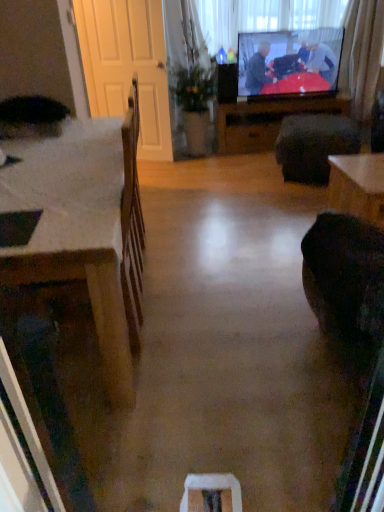
Question: Should I look upward or downward to see green leafy plant at center?

Choices:
 (A) up
 (B) down

Answer: (A)

Question: Is green leafy plant at center bigger than wooden desk at left?

Choices:
 (A) no
 (B) yes

Answer: (A)

Question: Is green leafy plant at center aimed at wooden desk at left?

Choices:
 (A) no
 (B) yes

Answer: (B)

Question: Is green leafy plant at center positioned before wooden desk at left?

Choices:
 (A) no
 (B) yes

Answer: (A)

Question: Is wooden desk at left at the back of green leafy plant at center?

Choices:
 (A) no
 (B) yes

Answer: (A)

Question: Can you confirm if green leafy plant at center is shorter than wooden desk at left?

Choices:
 (A) yes
 (B) no

Answer: (B)

Question: Does green leafy plant at center have a greater height compared to wooden desk at left?

Choices:
 (A) yes
 (B) no

Answer: (A)

Question: Is wooden desk at left to the right of transparent plastic window screen at upper center from the viewer's perspective?

Choices:
 (A) no
 (B) yes

Answer: (A)

Question: Is wooden desk at left aimed at transparent plastic window screen at upper center?

Choices:
 (A) no
 (B) yes

Answer: (A)

Question: Is wooden desk at left not within transparent plastic window screen at upper center?

Choices:
 (A) no
 (B) yes

Answer: (B)

Question: From a real-world perspective, is wooden desk at left physically below transparent plastic window screen at upper center?

Choices:
 (A) no
 (B) yes

Answer: (B)

Question: Does wooden desk at left have a greater width compared to transparent plastic window screen at upper center?

Choices:
 (A) no
 (B) yes

Answer: (B)

Question: Can you confirm if wooden desk at left is thinner than transparent plastic window screen at upper center?

Choices:
 (A) yes
 (B) no

Answer: (B)

Question: From the image's perspective, is green leafy plant at center on flat screen tv at upper center?

Choices:
 (A) no
 (B) yes

Answer: (A)